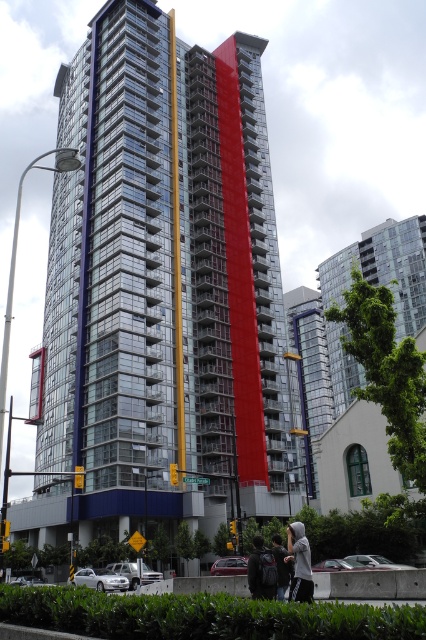
You are a delivery person standing in front of the high rise building. You need to place a gray hoodie at center and a dark gray backpack at center in your delivery truck. How far apart are these two items currently?

The gray hoodie at center and dark gray backpack at center are 1.32 meters apart from each other.

You are standing in the middle of the urban landscape looking at the highrise building. There is a gray hoodie at center. Where exactly is the gray hoodie located in terms of coordinates?

The gray hoodie at center is located at point (299, 563).